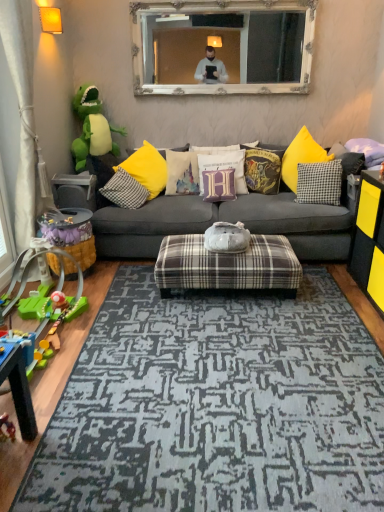
This screenshot has height=512, width=384. I want to click on vacant area situated below white ornate mirror at upper center (from a real-world perspective), so click(226, 141).